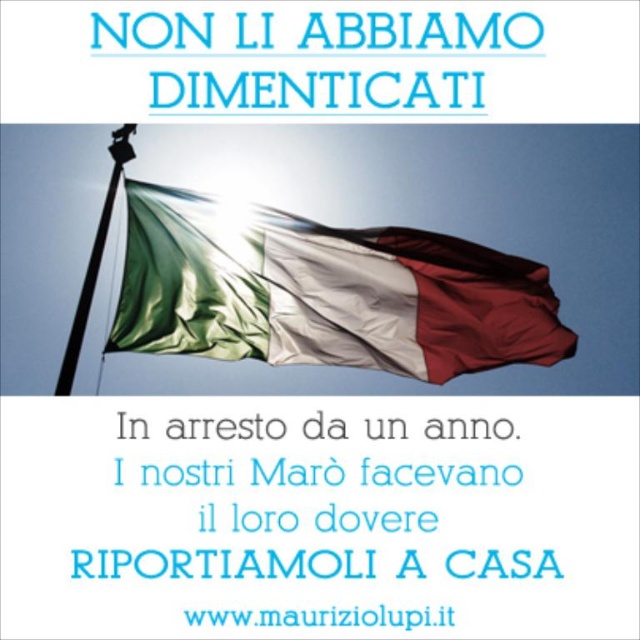
From the picture: You are a painter standing 2 meters away from the black metal flag pole at upper left. You want to paint the silky fabric flag at center. Can you reach the flag with your 2.5 meter long paintbrush?

The distance between the silky fabric flag at center and the black metal flag pole at upper left is 3.10 meters. Since you are standing 2 meters away from the pole, the total distance to the flag would be 2 meters plus 3.10 meters, totaling 5.10 meters. Your paintbrush is only 2.5 meters long, so you cannot reach the flag.

You are standing in front of the Italian flag scene. There are two points marked in the image at coordinates point [365,273] and point [118,157]. Which point is closer to you?

Point [365,273] is in front of point [118,157], so it is closer to you.